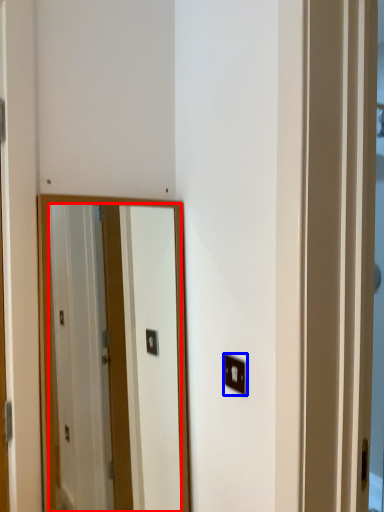
Question: Which of the following is the closest to the observer, mirror (highlighted by a red box) or light switch (highlighted by a blue box)?

Choices:
 (A) mirror
 (B) light switch

Answer: (A)